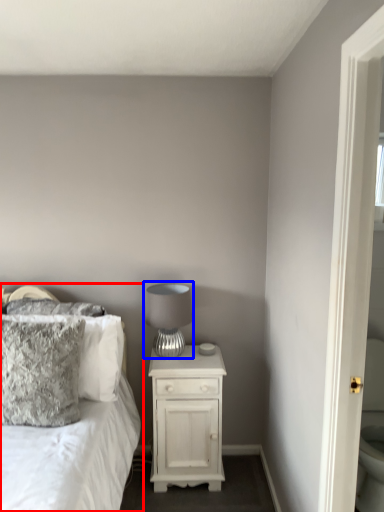
Question: Which object is closer to the camera taking this photo, bed (highlighted by a red box) or table lamp (highlighted by a blue box)?

Choices:
 (A) bed
 (B) table lamp

Answer: (A)